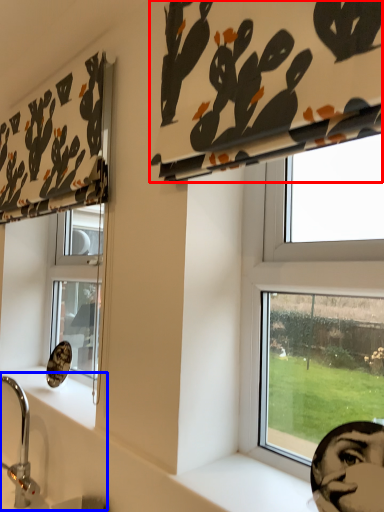
Question: Among these objects, which one is nearest to the camera, curtain (highlighted by a red box) or sink (highlighted by a blue box)?

Choices:
 (A) curtain
 (B) sink

Answer: (A)